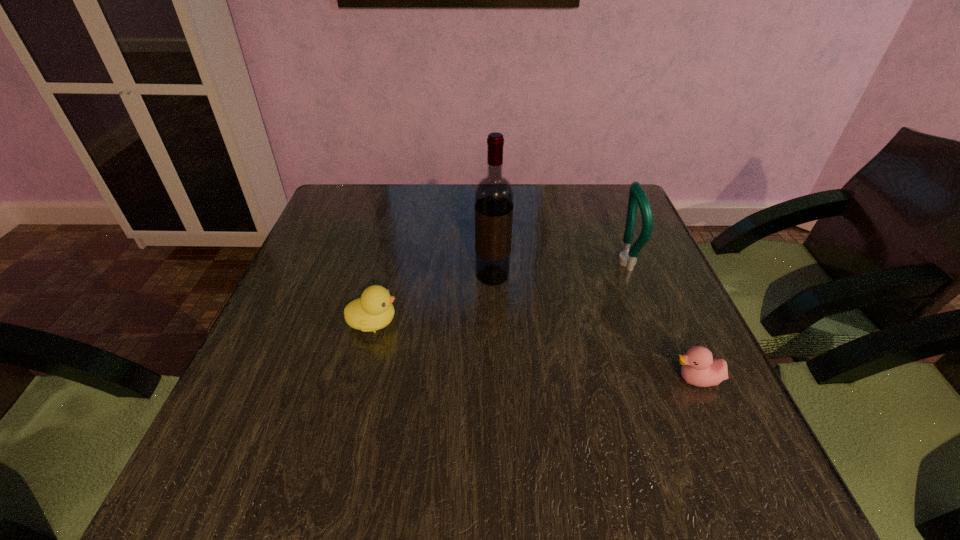
Where is `vacant space at the right edge of the desktop`? vacant space at the right edge of the desktop is located at coordinates (670, 355).

I want to click on vacant region at the far left corner, so click(x=380, y=184).

Identify the location of free area in between the third farthest object and the tallest object. (433, 299).

Image resolution: width=960 pixels, height=540 pixels. In order to click on free space between the leftmost object and the bottle opener in this screenshot , I will do `click(498, 292)`.

Find the location of `empty location between the third farthest object and the third shortest object`. empty location between the third farthest object and the third shortest object is located at coordinates (498, 292).

Image resolution: width=960 pixels, height=540 pixels. Identify the location of free area in between the taller duckling and the shortest object. (535, 351).

Where is `vacant area that lies between the third farthest object and the second tallest object`? vacant area that lies between the third farthest object and the second tallest object is located at coordinates (498, 292).

At what (x,y) coordinates should I click in order to perform the action: click on free space between the second object from left to right and the bottle opener. Please return your answer as a coordinate pair (x, y). The height and width of the screenshot is (540, 960). Looking at the image, I should click on (558, 269).

The image size is (960, 540). I want to click on vacant area between the third object from right to left and the leftmost object, so click(433, 299).

The image size is (960, 540). In order to click on vacant region between the second shortest object and the second object from left to right in this screenshot , I will do `click(433, 299)`.